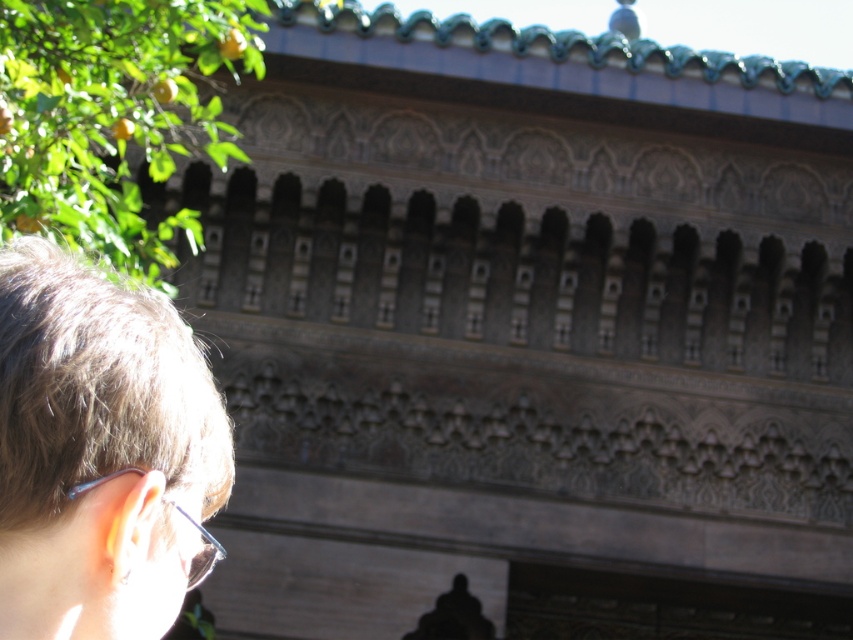
You are standing in front of the ornate architectural structure and notice a person in the foreground. Which object, the brown hair at left or the clear plastic glasses at lower left, is positioned lower from the ground?

The clear plastic glasses at lower left are positioned lower from the ground than the brown hair at left because the brown hair at left is not as tall as the clear plastic glasses at lower left, meaning the glasses are closer to the ground.

You are an architect analyzing the symmetry of the building in the scene. You notice the green leafy tree at upper left and the clear plastic glasses at lower left. Which object takes up more space in the image?

The green leafy tree at upper left takes up more space in the image as it has a larger size compared to the clear plastic glasses at lower left.